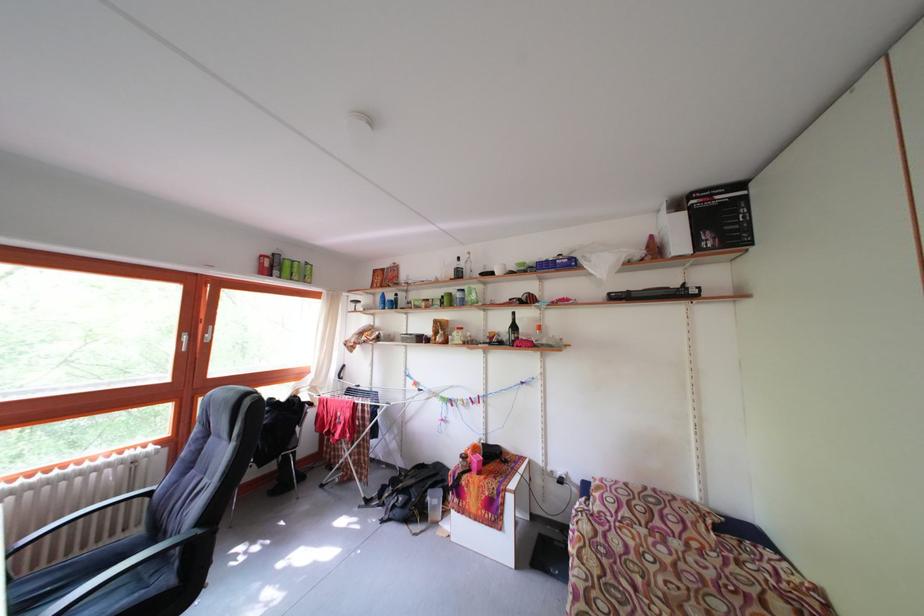
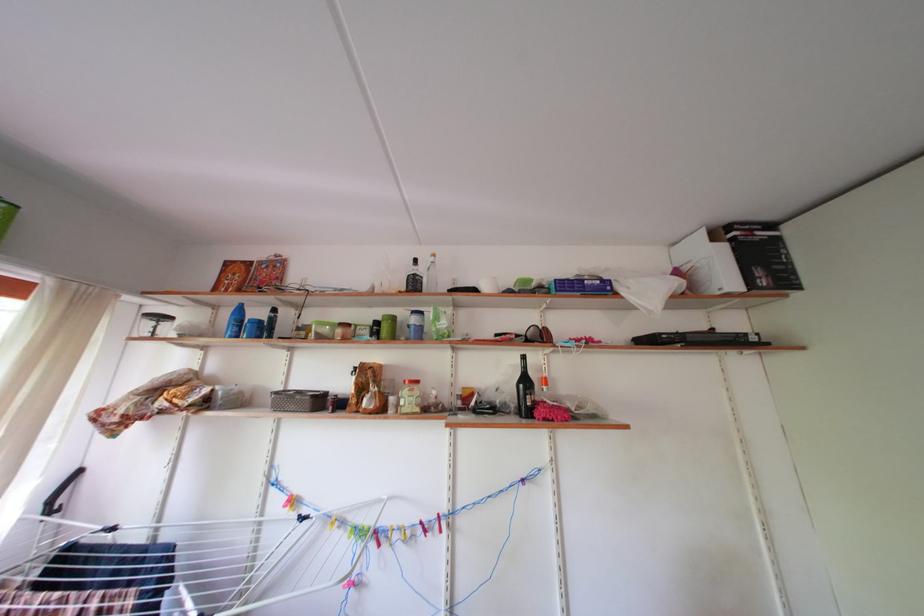
Locate, in the second image, the point that corresponds to point 388,297 in the first image.

(242, 305)